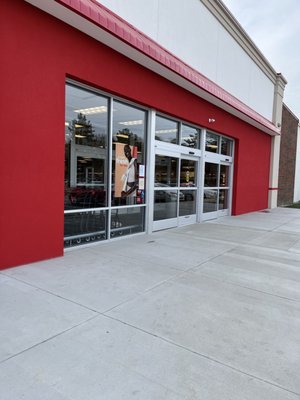
The height and width of the screenshot is (400, 300). Identify the location of glass doors. (173, 197).